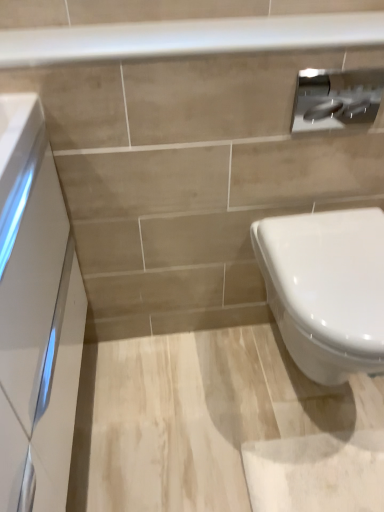
Question: Is there a large distance between satin silver toilet paper at upper right and white glossy cabinet at left?

Choices:
 (A) no
 (B) yes

Answer: (A)

Question: From a real-world perspective, is satin silver toilet paper at upper right located beneath white glossy cabinet at left?

Choices:
 (A) yes
 (B) no

Answer: (B)

Question: Is the position of satin silver toilet paper at upper right more distant than that of white glossy cabinet at left?

Choices:
 (A) no
 (B) yes

Answer: (B)

Question: Considering the relative positions of satin silver toilet paper at upper right and white glossy cabinet at left in the image provided, is satin silver toilet paper at upper right to the left of white glossy cabinet at left from the viewer's perspective?

Choices:
 (A) no
 (B) yes

Answer: (A)

Question: From the image's perspective, is satin silver toilet paper at upper right below white glossy cabinet at left?

Choices:
 (A) no
 (B) yes

Answer: (A)

Question: Does satin silver toilet paper at upper right have a larger size compared to white glossy cabinet at left?

Choices:
 (A) yes
 (B) no

Answer: (B)

Question: From a real-world perspective, is white glossy toilet at lower right under white glossy balustrade at upper center?

Choices:
 (A) no
 (B) yes

Answer: (B)

Question: From the image's perspective, does white glossy toilet at lower right appear lower than white glossy balustrade at upper center?

Choices:
 (A) no
 (B) yes

Answer: (B)

Question: Is white glossy toilet at lower right facing away from white glossy balustrade at upper center?

Choices:
 (A) yes
 (B) no

Answer: (B)

Question: Is the depth of white glossy toilet at lower right greater than that of white glossy balustrade at upper center?

Choices:
 (A) no
 (B) yes

Answer: (A)

Question: Could you tell me if white glossy toilet at lower right is turned towards white glossy balustrade at upper center?

Choices:
 (A) no
 (B) yes

Answer: (A)

Question: Is the position of white glossy toilet at lower right less distant than that of white glossy balustrade at upper center?

Choices:
 (A) yes
 (B) no

Answer: (A)

Question: Does white glossy cabinet at left lie in front of satin silver toilet paper at upper right?

Choices:
 (A) yes
 (B) no

Answer: (A)